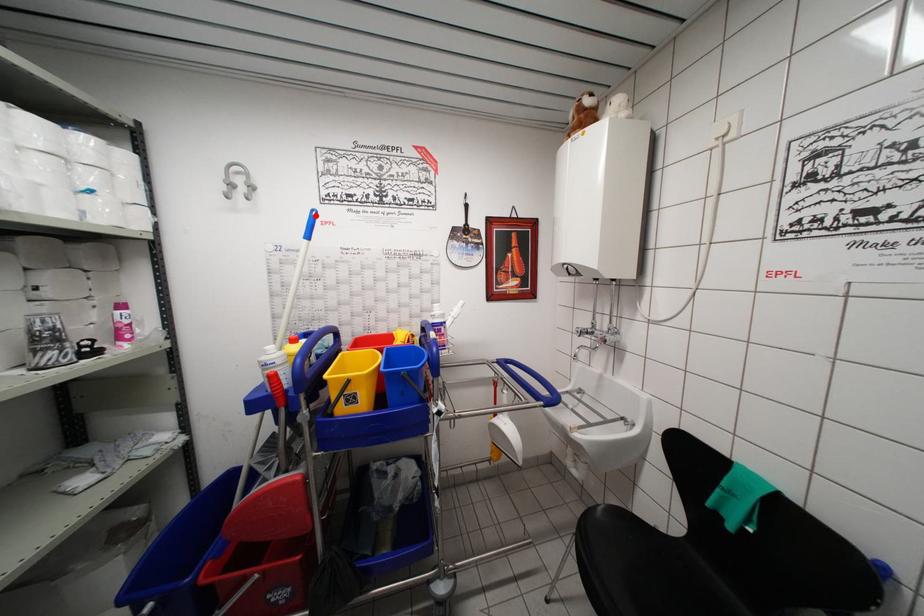
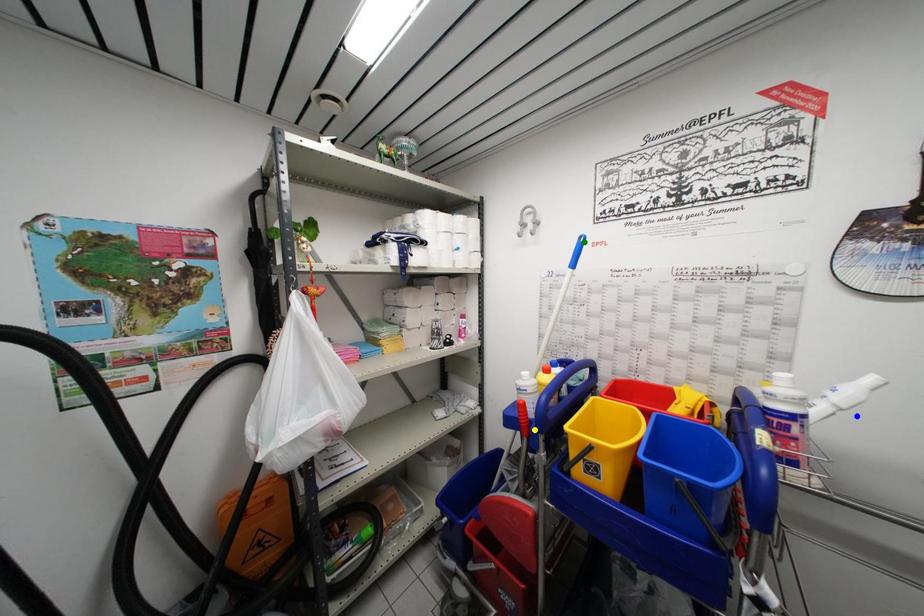
Question: I am providing you with two images of the same scene from different viewpoints. A red point is marked on the first image. You are given multiple points on the second image. Which point in image 2 is actually the same real-world point as the red point in image 1?

Choices:
 (A) blue point
 (B) yellow point
 (C) green point

Answer: (C)